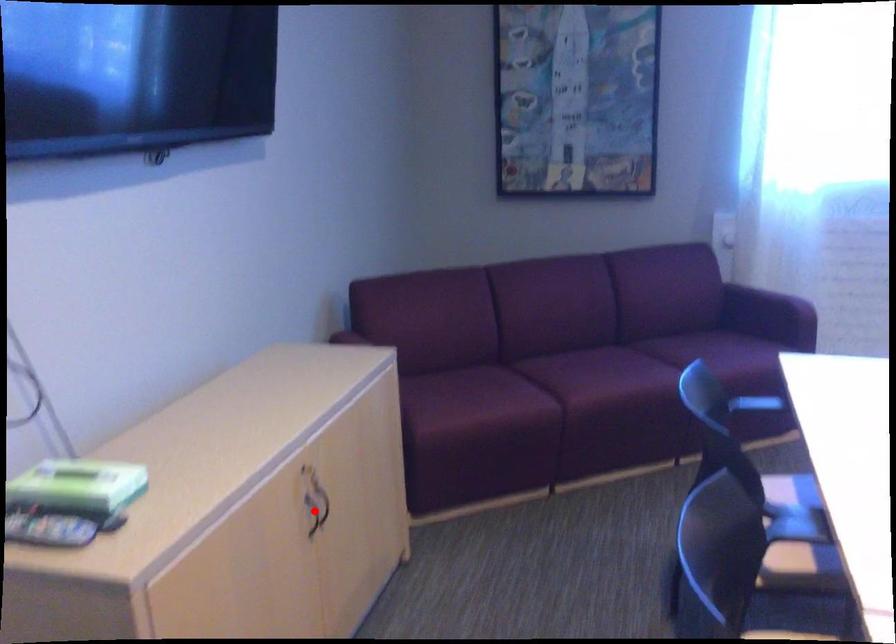
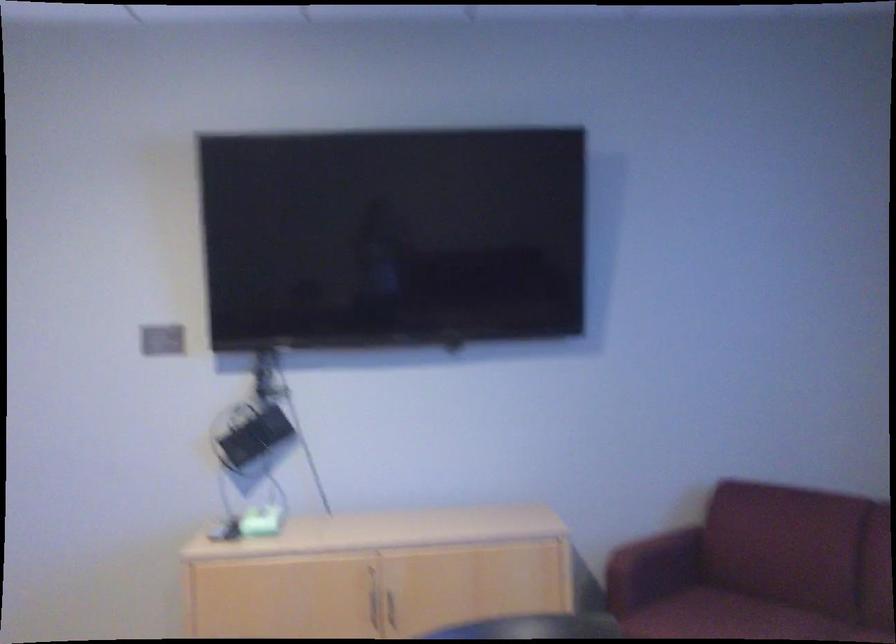
Locate, in the second image, the point that corresponds to the highlighted location in the first image.

(374, 607)